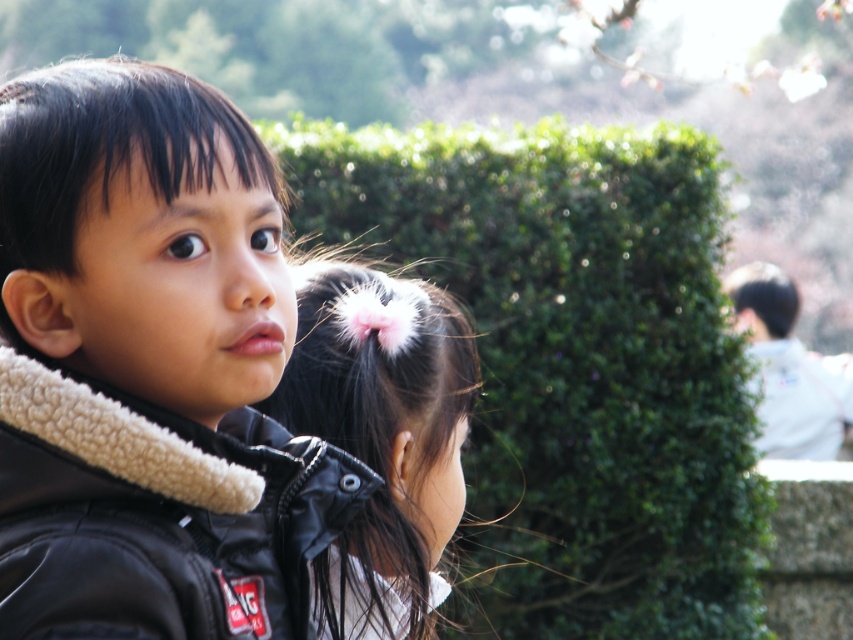
You are a photographer trying to capture a clear shot of the black matte jacket at center without the green leafy hedge at center blocking it. What adjustment should you make to your camera angle?

The green leafy hedge at center is positioned over the black matte jacket at center, so you should lower your camera angle to avoid the hedge blocking the jacket.

You are a photographer setting up for a group photo. You see the black fleece jacket at left and the white cotton shirt at right in the scene. Can you position yourself so that both are in frame without moving them? Explain your reasoning based on their distance apart.

The black fleece jacket at left and the white cotton shirt at right are 21.39 feet apart. Since 21.39 feet is a manageable distance for a photographer to capture both subjects in a single frame, especially in a wide shot, you can position yourself at a distance that allows both to be included. A standard lens or wide angle could achieve this without needing to move either subject.